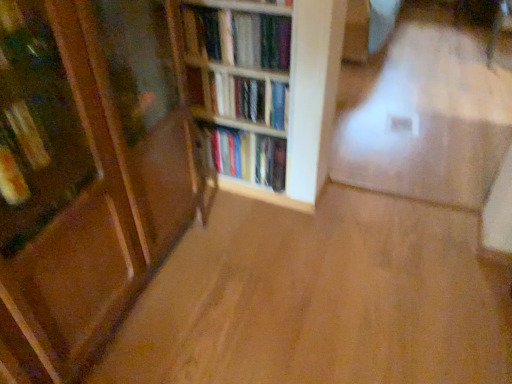
Question: In terms of size, does hardcover books at center, the first book in the bottom-to-top sequence, appear bigger or smaller than wooden bookshelf at center, which ranks as the first book in top-to-bottom order?

Choices:
 (A) big
 (B) small

Answer: (A)

Question: Do you think hardcover books at center, which is counted as the third book, starting from the top, is within wooden bookshelf at center, which ranks as the first book in top-to-bottom order, or outside of it?

Choices:
 (A) inside
 (B) outside

Answer: (B)

Question: Which object is the closest to the wooden bookshelf at center, marked as the third book in a bottom-to-top arrangement?

Choices:
 (A) wooden bookshelf at center
 (B) hardcover books at center, which is counted as the third book, starting from the top
 (C) hardcover books at center, the second book in the top-to-bottom sequence
 (D) white glossy wall at upper center

Answer: (A)

Question: Which of these objects is positioned closest to the hardcover books at center, the second book in the top-to-bottom sequence?

Choices:
 (A) white glossy wall at upper center
 (B) wooden bookshelf at center, which ranks as the first book in top-to-bottom order
 (C) hardcover books at center, the first book in the bottom-to-top sequence
 (D) wooden bookshelf at center

Answer: (D)